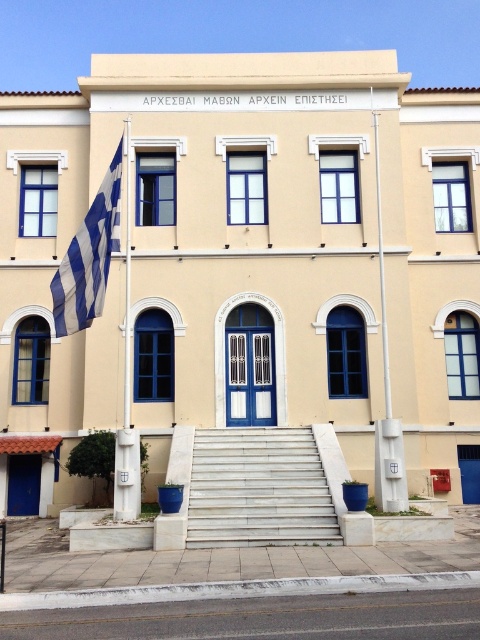
You are a visitor approaching the beige stucco building at center and the white painted metal flag pole at left. Which object will appear taller to you as you stand at the bottom of the steps?

The beige stucco building at center appears taller than the white painted metal flag pole at left because it has a larger size compared to it.

You are standing at the bottom of the steps leading to the beige stucco building at center. You want to see the white painted metal flag pole at left. In which direction should you look relative to the building?

The white painted metal flag pole at left is behind the beige stucco building at center, so you should look behind the building to see it.